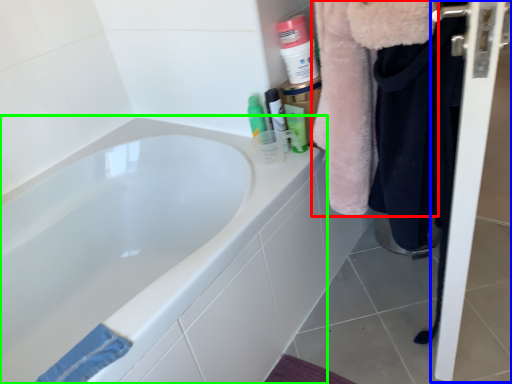
Question: Considering the real-world distances, which object is closest to fur coat (highlighted by a red box)? screen door (highlighted by a blue box) or bathtub (highlighted by a green box).

Choices:
 (A) screen door
 (B) bathtub

Answer: (A)